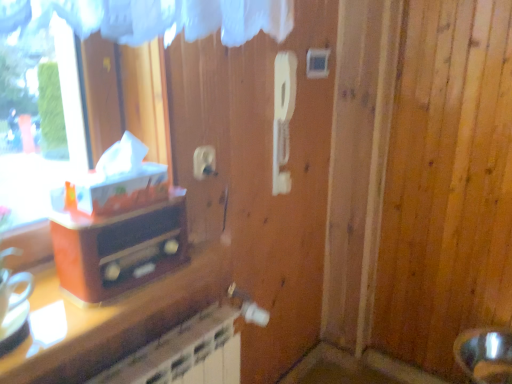
Question: Can you confirm if matte orange radio at left is smaller than white plastic electric outlet at upper center?

Choices:
 (A) yes
 (B) no

Answer: (B)

Question: Is matte orange radio at left oriented towards white plastic electric outlet at upper center?

Choices:
 (A) no
 (B) yes

Answer: (A)

Question: From a real-world perspective, does matte orange radio at left stand above white plastic electric outlet at upper center?

Choices:
 (A) yes
 (B) no

Answer: (B)

Question: Is matte orange radio at left located outside white plastic electric outlet at upper center?

Choices:
 (A) yes
 (B) no

Answer: (A)

Question: Is matte orange radio at left directly adjacent to white plastic electric outlet at upper center?

Choices:
 (A) yes
 (B) no

Answer: (B)

Question: Is matte orange radio at left to the left of white plastic electric outlet at upper center from the viewer's perspective?

Choices:
 (A) no
 (B) yes

Answer: (B)

Question: Does white plastic light switch at upper center have a greater height compared to matte orange radio at left?

Choices:
 (A) yes
 (B) no

Answer: (B)

Question: Are white plastic light switch at upper center and matte orange radio at left located far from each other?

Choices:
 (A) yes
 (B) no

Answer: (B)

Question: Is matte orange radio at left located within white plastic light switch at upper center?

Choices:
 (A) no
 (B) yes

Answer: (A)

Question: From a real-world perspective, is white plastic light switch at upper center physically above matte orange radio at left?

Choices:
 (A) no
 (B) yes

Answer: (B)

Question: Can you confirm if white plastic light switch at upper center is thinner than matte orange radio at left?

Choices:
 (A) no
 (B) yes

Answer: (B)

Question: Is white plastic light switch at upper center at the left side of matte orange radio at left?

Choices:
 (A) no
 (B) yes

Answer: (A)

Question: Is the depth of white plastic light switch at upper center greater than that of white plastic electric outlet at upper center?

Choices:
 (A) no
 (B) yes

Answer: (B)